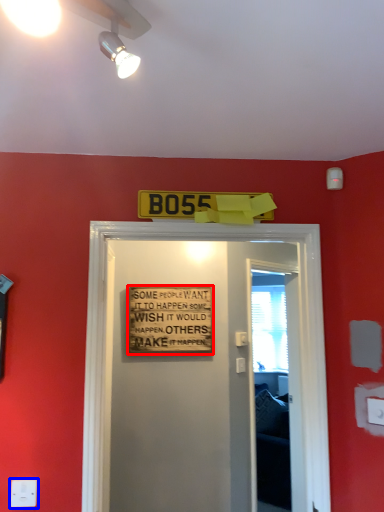
Question: Among these objects, which one is farthest to the camera, warning sign (highlighted by a red box) or electric outlet (highlighted by a blue box)?

Choices:
 (A) warning sign
 (B) electric outlet

Answer: (A)